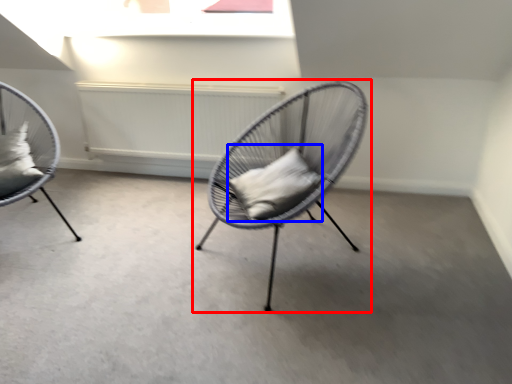
Question: Which object appears closest to the camera in this image, chair (highlighted by a red box) or pillow (highlighted by a blue box)?

Choices:
 (A) chair
 (B) pillow

Answer: (A)